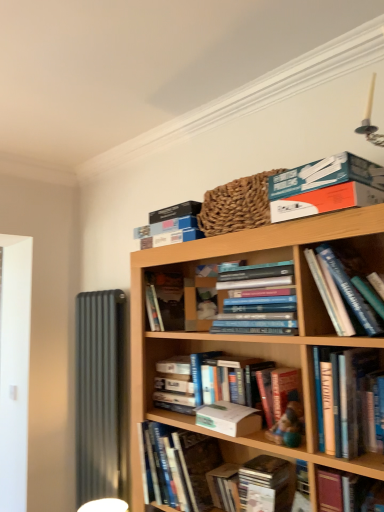
Question: Is blue cardboard box at upper center, the ninth book from the bottom, facing away from hardcover book at center, positioned as the 5th book in bottom-to-top order?

Choices:
 (A) no
 (B) yes

Answer: (A)

Question: Does blue cardboard box at upper center, which ranks as the 1th book in top-to-bottom order, lie in front of hardcover book at center, which ranks as the 5th book in top-to-bottom order?

Choices:
 (A) yes
 (B) no

Answer: (A)

Question: From the image's perspective, is blue cardboard box at upper center, which ranks as the 1th book in top-to-bottom order, under hardcover book at center, which ranks as the 5th book in top-to-bottom order?

Choices:
 (A) no
 (B) yes

Answer: (A)

Question: Could you tell me if blue cardboard box at upper center, the ninth book from the bottom, is facing hardcover book at center, which ranks as the 5th book in top-to-bottom order?

Choices:
 (A) no
 (B) yes

Answer: (A)

Question: Is hardcover book at center, positioned as the 5th book in bottom-to-top order, a part of blue cardboard box at upper center, the ninth book from the bottom?

Choices:
 (A) yes
 (B) no

Answer: (B)

Question: From the image's perspective, is blue cardboard box at upper center, which ranks as the 1th book in top-to-bottom order, on hardcover book at center, positioned as the 5th book in bottom-to-top order?

Choices:
 (A) no
 (B) yes

Answer: (B)

Question: Considering the relative sizes of hardcover book at center, arranged as the eighth book when viewed from the top, and hardcover book at upper center, the third book from the top, in the image provided, is hardcover book at center, arranged as the eighth book when viewed from the top, shorter than hardcover book at upper center, the third book from the top,?

Choices:
 (A) no
 (B) yes

Answer: (B)

Question: From a real-world perspective, is hardcover book at center, arranged as the eighth book when viewed from the top, physically above hardcover book at upper center, the seventh book ordered from the bottom?

Choices:
 (A) yes
 (B) no

Answer: (B)

Question: Is hardcover book at center, acting as the second book starting from the bottom, positioned behind hardcover book at upper center, the third book from the top?

Choices:
 (A) yes
 (B) no

Answer: (A)

Question: From the image's perspective, is hardcover book at center, acting as the second book starting from the bottom, located beneath hardcover book at upper center, the third book from the top?

Choices:
 (A) no
 (B) yes

Answer: (B)

Question: Can you confirm if hardcover book at center, acting as the second book starting from the bottom, is smaller than hardcover book at upper center, the seventh book ordered from the bottom?

Choices:
 (A) yes
 (B) no

Answer: (B)

Question: Could you tell me if hardcover book at center, acting as the second book starting from the bottom, is facing hardcover book at upper center, the seventh book ordered from the bottom?

Choices:
 (A) no
 (B) yes

Answer: (A)

Question: Is wooden cd case at lower center, the first book when ordered from bottom to top, completely or partially inside hardcover book at center, which ranks as the 6th book in top-to-bottom order?

Choices:
 (A) no
 (B) yes

Answer: (A)